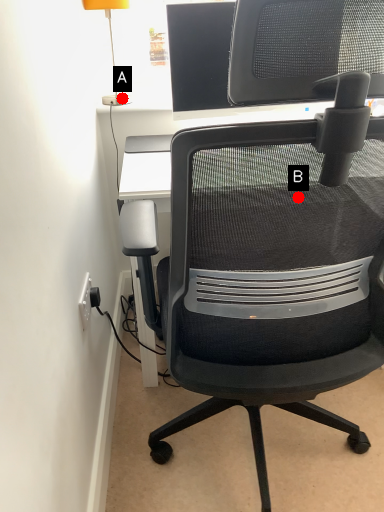
Question: Two points are circled on the image, labeled by A and B beside each circle. Which point is farther from the camera taking this photo?

Choices:
 (A) A is further
 (B) B is further

Answer: (A)